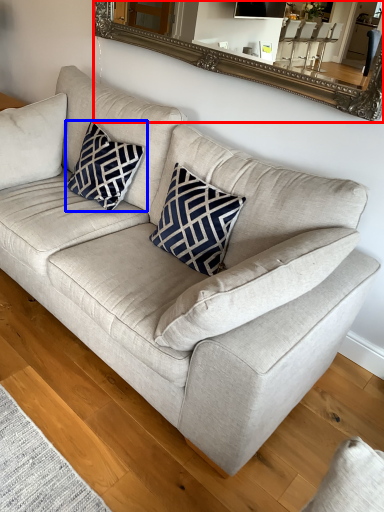
Question: Which of the following is the farthest to the observer, mirror (highlighted by a red box) or pillow (highlighted by a blue box)?

Choices:
 (A) mirror
 (B) pillow

Answer: (B)